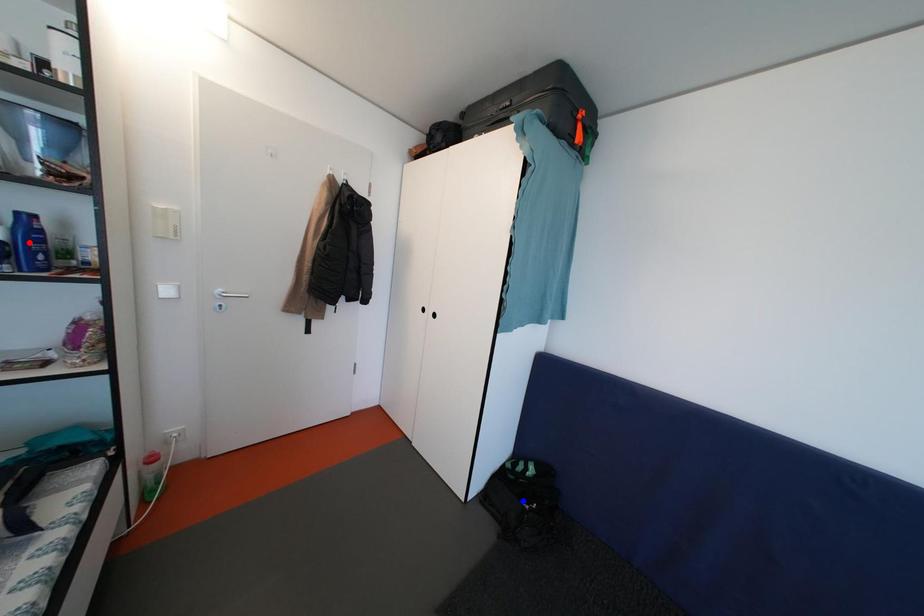
Question: Two points are marked on the image. Which point is closer to the camera?

Choices:
 (A) Blue point is closer.
 (B) Red point is closer.

Answer: (B)